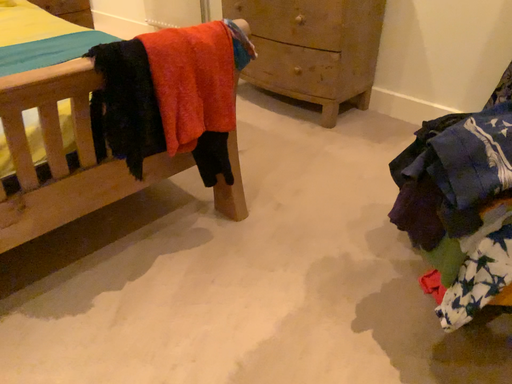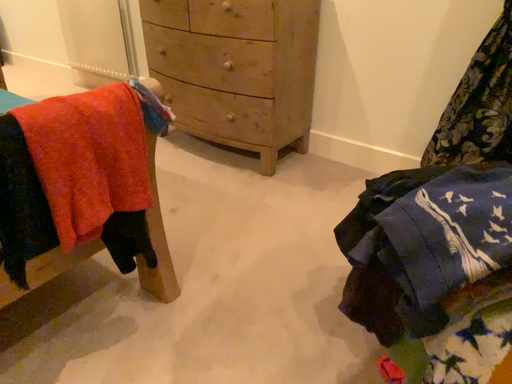
Question: How did the camera likely rotate when shooting the video?

Choices:
 (A) rotated right
 (B) rotated left

Answer: (A)